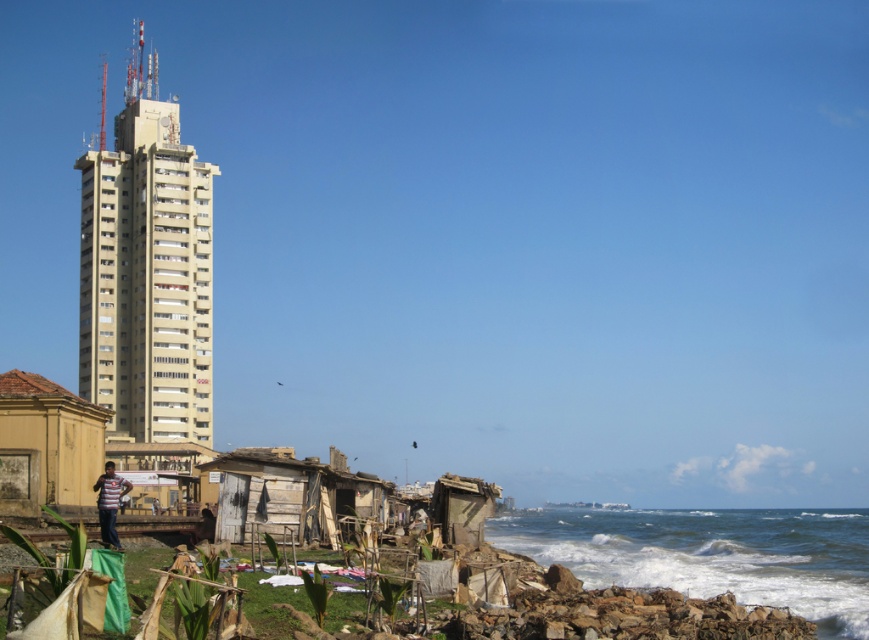
You are a delivery person trying to navigate through the area between the wooden shack at lower left and the striped fabric shirt at lower left. Can you pass through sideways without bending? Please explain based on their sizes.

The wooden shack at lower left is wider than the striped fabric shirt at lower left. Since the wooden shack is larger in width, the path between them might be narrow. However, without specific measurements of the path width, it is uncertain if you can pass sideways without bending. The answer depends on the actual space available between the two objects.

Based on the scene description, where is the weathered wood hut at lower center located in the image?

The weathered wood hut at lower center is located at the 2D coordinates point [290,492] in the image.

You are a delivery person who needs to deliver a package to the yellow textured hut at lower left. You are currently standing at the weathered wood hut at lower center. Which direction should you move to reach the destination?

The weathered wood hut at lower center is positioned on the left side of yellow textured hut at lower left. To reach the yellow textured hut at lower left from the weathered wood hut at lower center, you should move to the right.